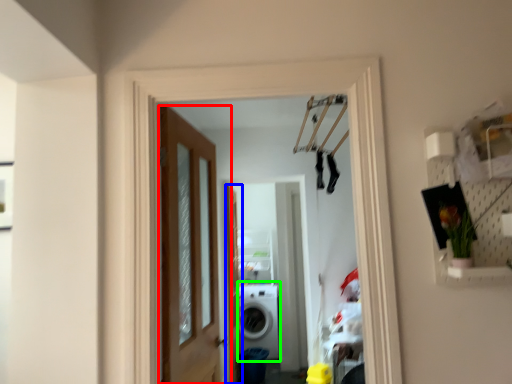
Question: Which is nearer to the door (highlighted by a red box)? screen door (highlighted by a blue box) or washing machine (highlighted by a green box).

Choices:
 (A) screen door
 (B) washing machine

Answer: (A)